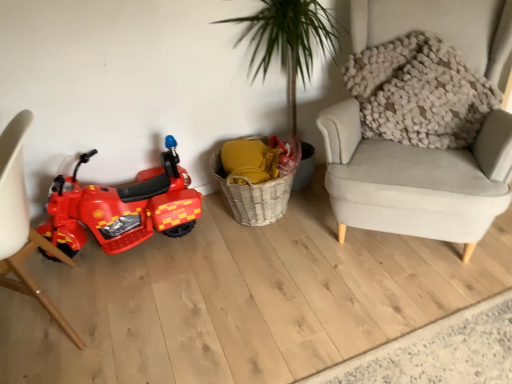
Question: Is woven basket at center taller than shiny plastic toy motorcycle at left?

Choices:
 (A) yes
 (B) no

Answer: (B)

Question: Does woven basket at center have a lesser height compared to shiny plastic toy motorcycle at left?

Choices:
 (A) yes
 (B) no

Answer: (A)

Question: Is the depth of woven basket at center less than that of shiny plastic toy motorcycle at left?

Choices:
 (A) yes
 (B) no

Answer: (B)

Question: From the image's perspective, is woven basket at center on top of shiny plastic toy motorcycle at left?

Choices:
 (A) yes
 (B) no

Answer: (A)

Question: From a real-world perspective, does woven basket at center sit lower than shiny plastic toy motorcycle at left?

Choices:
 (A) yes
 (B) no

Answer: (A)

Question: From the image's perspective, is woven basket at center located above or below shiny plastic toy motorcycle at left?

Choices:
 (A) below
 (B) above

Answer: (B)

Question: Considering the positions of woven basket at center and shiny plastic toy motorcycle at left in the image, is woven basket at center bigger or smaller than shiny plastic toy motorcycle at left?

Choices:
 (A) big
 (B) small

Answer: (B)

Question: Considering their positions, is woven basket at center located in front of or behind shiny plastic toy motorcycle at left?

Choices:
 (A) behind
 (B) front

Answer: (A)

Question: In terms of height, does woven basket at center look taller or shorter compared to shiny plastic toy motorcycle at left?

Choices:
 (A) short
 (B) tall

Answer: (A)

Question: Is point (119, 203) closer or farther from the camera than point (11, 148)?

Choices:
 (A) closer
 (B) farther

Answer: (B)

Question: From the image's perspective, is shiny plastic toy motorcycle at left located above or below matte white chair at left?

Choices:
 (A) above
 (B) below

Answer: (A)

Question: Visually, is shiny plastic toy motorcycle at left positioned to the left or to the right of matte white chair at left?

Choices:
 (A) left
 (B) right

Answer: (B)

Question: Is shiny plastic toy motorcycle at left inside or outside of matte white chair at left?

Choices:
 (A) inside
 (B) outside

Answer: (B)

Question: In terms of size, does matte white chair at left appear bigger or smaller than shiny plastic toy motorcycle at left?

Choices:
 (A) small
 (B) big

Answer: (B)

Question: Is matte white chair at left to the left or to the right of shiny plastic toy motorcycle at left in the image?

Choices:
 (A) right
 (B) left

Answer: (B)